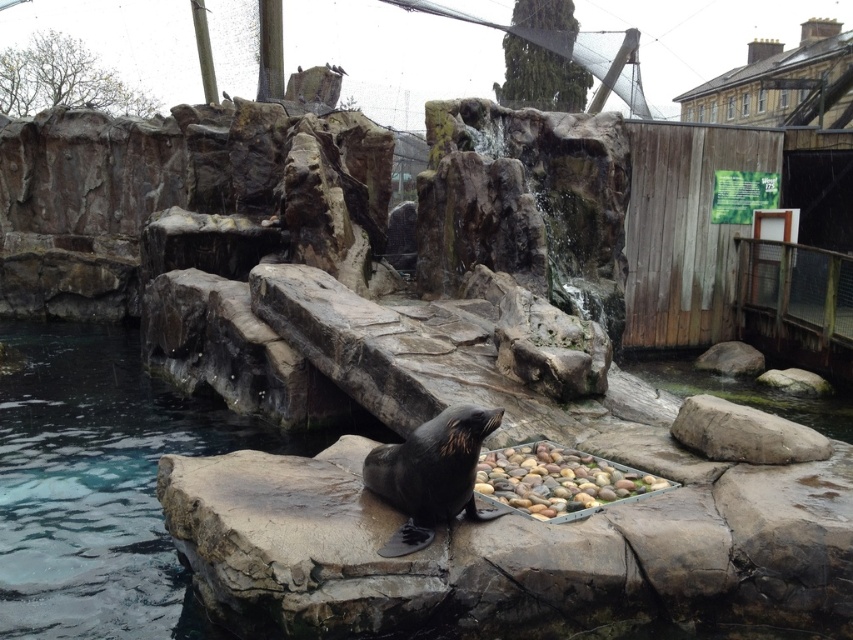
Who is taller, clear water at rock bottom or smooth pebbles at center?

clear water at rock bottom

Between point (96, 637) and point (485, 452), which one is positioned behind?

Point (485, 452)

The width and height of the screenshot is (853, 640). Identify the location of clear water at rock bottom. (100, 486).

How distant is smooth pebbles at center from gray rough rock at center?

smooth pebbles at center is 4.15 feet away from gray rough rock at center.

Which of these two, smooth pebbles at center or gray rough rock at center, stands taller?

gray rough rock at center is taller.

Where is `smooth pebbles at center`? smooth pebbles at center is located at coordinates (558, 481).

Can you confirm if gray rough rock at center is shorter than smooth gray rock at center-right?

Correct, gray rough rock at center is not as tall as smooth gray rock at center-right.

Who is positioned more to the right, gray rough rock at center or smooth gray rock at center-right?

Positioned to the right is smooth gray rock at center-right.

Does point (692, 400) come behind point (698, 365)?

No, it is in front of (698, 365).

Where is `gray rough rock at center`? This screenshot has height=640, width=853. gray rough rock at center is located at coordinates (744, 433).